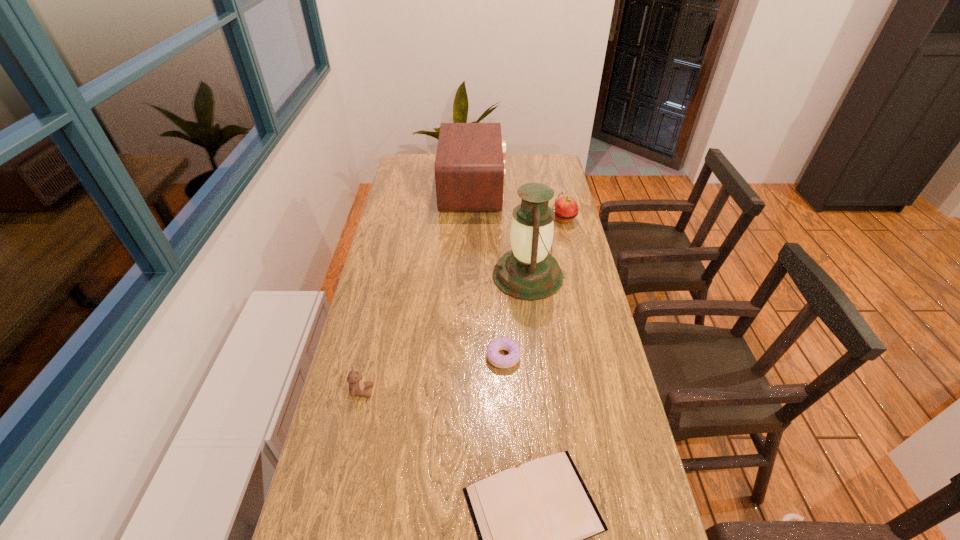
I want to click on vacant space that satisfies the following two spatial constraints: 1. on the front panel of the second tallest object; 2. on the left side of the second shortest object, so click(x=470, y=357).

Identify the location of free space in the image that satisfies the following two spatial constraints: 1. on the front panel of the apple; 2. on the right side of the second tallest object. (473, 219).

Locate an element on the screen. vacant region that satisfies the following two spatial constraints: 1. on the front panel of the radio receiver; 2. on the left side of the third tallest object is located at coordinates (473, 219).

This screenshot has height=540, width=960. I want to click on vacant position in the image that satisfies the following two spatial constraints: 1. on the back side of the apple; 2. on the front panel of the second tallest object, so click(557, 189).